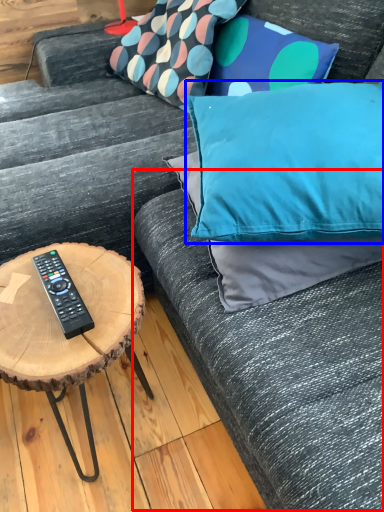
Question: Which point is closer to the camera, couch (highlighted by a red box) or pillow (highlighted by a blue box)?

Choices:
 (A) couch
 (B) pillow

Answer: (A)